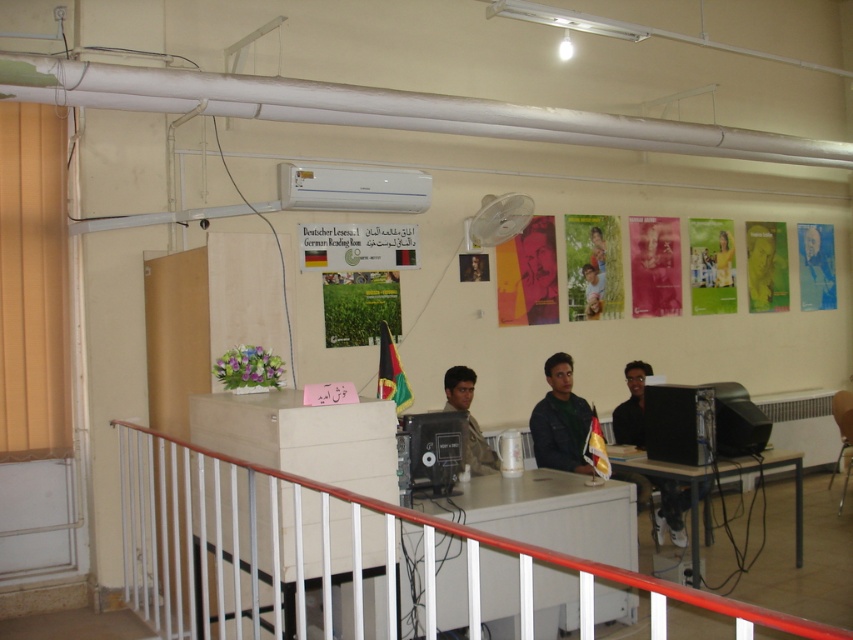
Question: Considering the real-world distances, which object is closest to the yellow fabric shirt at center?

Choices:
 (A) dark green leather jacket at center
 (B) white metal railing at lower center
 (C) white plastic table at lower center
 (D) matte khaki uniform at center

Answer: (A)

Question: Is wooden table at lower right positioned in front of dark green leather jacket at center?

Choices:
 (A) yes
 (B) no

Answer: (A)

Question: Considering the relative positions of white plastic table at lower center and matte green shirt at center in the image provided, where is white plastic table at lower center located with respect to matte green shirt at center?

Choices:
 (A) right
 (B) left

Answer: (B)

Question: Which point is closer to the camera?

Choices:
 (A) (492, 465)
 (B) (593, 294)
 (C) (577, 586)

Answer: (C)

Question: Which point is closer to the camera?

Choices:
 (A) (621, 436)
 (B) (688, 474)

Answer: (B)

Question: Can you confirm if dark brown leather jacket at center is thinner than matte green shirt at center?

Choices:
 (A) no
 (B) yes

Answer: (A)